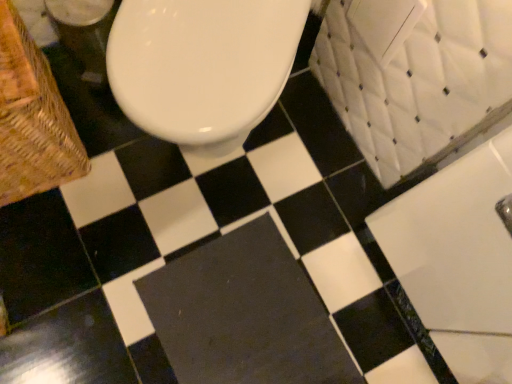
Question: From a real-world perspective, is woven wood basket at left positioned above or below dark gray rubber bath mat at center?

Choices:
 (A) above
 (B) below

Answer: (A)

Question: Is point (49, 97) closer or farther from the camera than point (250, 281)?

Choices:
 (A) closer
 (B) farther

Answer: (A)

Question: Which is farther from the white glossy bath at upper right?

Choices:
 (A) dark gray rubber bath mat at center
 (B) woven wood basket at left

Answer: (B)

Question: Based on their relative distances, which object is nearer to the white glossy bath at upper right?

Choices:
 (A) woven wood basket at left
 (B) dark gray rubber bath mat at center

Answer: (B)